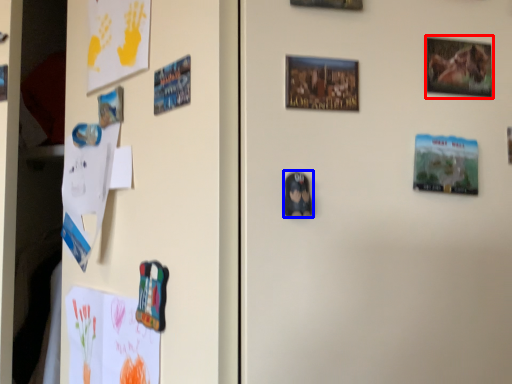
Question: Which object is closer to the camera taking this photo, picture frame (highlighted by a red box) or print (highlighted by a blue box)?

Choices:
 (A) picture frame
 (B) print

Answer: (B)